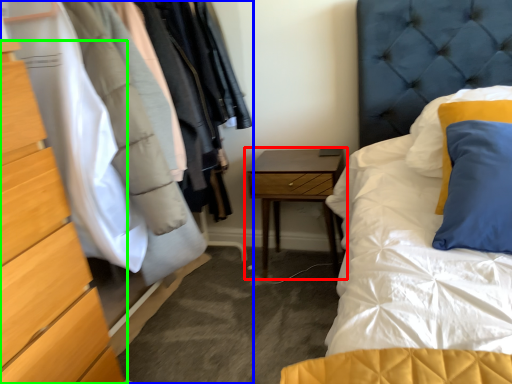
Question: Which is nearer to the nightstand (highlighted by a red box)? dresser (highlighted by a blue box) or chest of drawers (highlighted by a green box).

Choices:
 (A) dresser
 (B) chest of drawers

Answer: (A)